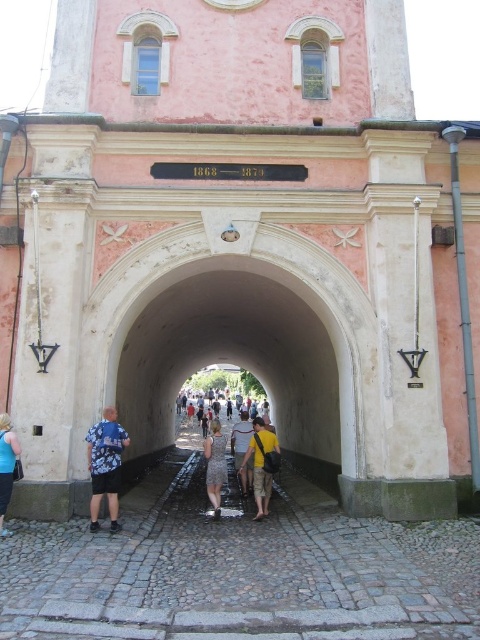
You are trying to decide which shirt to wear for a photoshoot. You want the shirt that will make you look taller. Based on the scene description, which shirt between the floral shirt at center and the dark gray cotton shirt at center should you choose?

The dark gray cotton shirt at center is taller than the floral shirt at center, so choosing the dark gray cotton shirt at center would make you appear taller.

You are standing in front of the historic archway and notice a patterned dress at center. Where exactly is the patterned dress located in relation to the archway?

The patterned dress at center is located at point coordinates of (215, 465) relative to the archway.

You are standing in front of the historic archway and notice two shirts hanging on the wall. The shirts are the floral shirt at center and the dark gray cotton shirt at center. Which shirt is closer to the archway?

Both the floral shirt at center and dark gray cotton shirt at center are hanging at the same distance from the archway since they are both positioned at the center.